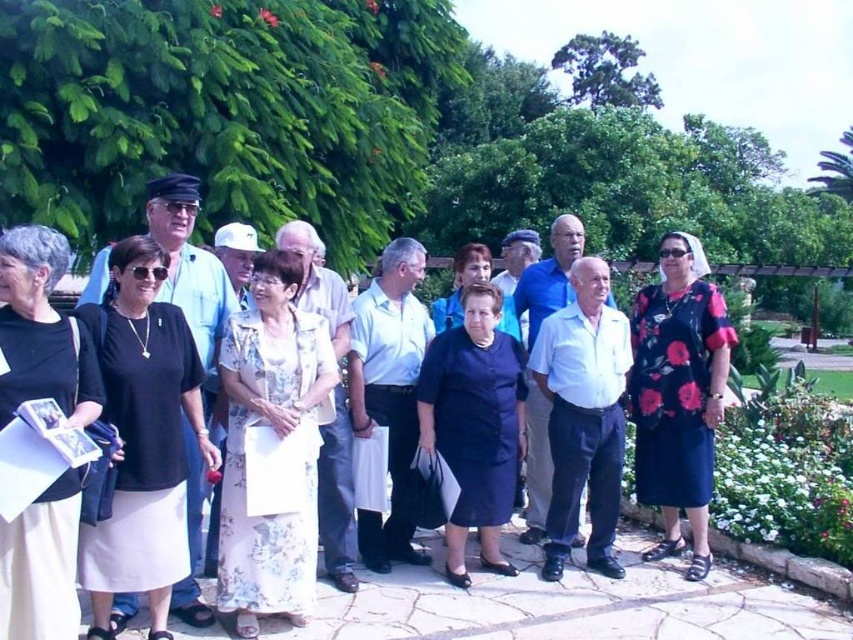
Question: Can you confirm if black matte dress at center is smaller than dark blue fabric dress at center?

Choices:
 (A) no
 (B) yes

Answer: (A)

Question: Which is farther from the floral-patterned dress at center?

Choices:
 (A) black satin skirt at lower left
 (B) black matte dress at center

Answer: (A)

Question: Which object appears closest to the camera in this image?

Choices:
 (A) floral fabric dress at center
 (B) black matte dress at center
 (C) black floral dress at lower right

Answer: (B)

Question: Is black matte dress at center below floral-patterned dress at center?

Choices:
 (A) yes
 (B) no

Answer: (A)

Question: Observing the image, what is the correct spatial positioning of floral-patterned dress at center in reference to black floral dress at lower right?

Choices:
 (A) above
 (B) below

Answer: (A)

Question: Estimate the real-world distances between objects in this image. Which object is farther from the black satin skirt at lower left?

Choices:
 (A) floral-patterned dress at center
 (B) dark blue fabric dress at center

Answer: (A)